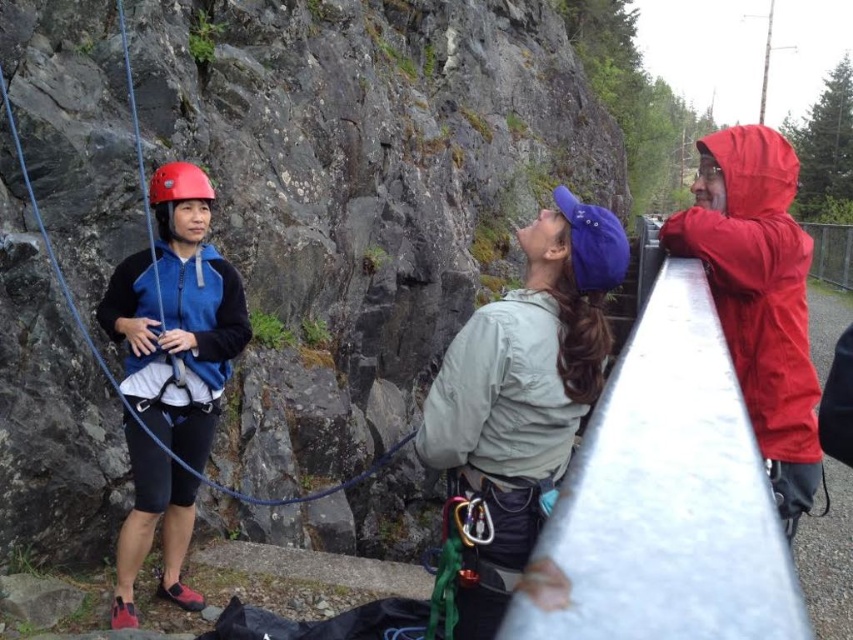
Can you confirm if matte blue jacket at left is wider than red waterproof jacket at upper right?

Incorrect, matte blue jacket at left's width does not surpass red waterproof jacket at upper right's.

Where is `matte blue jacket at left`? This screenshot has width=853, height=640. matte blue jacket at left is located at coordinates (177, 316).

Can you confirm if red waterproof jacket at upper right is taller than red matte helmet at left?

Correct, red waterproof jacket at upper right is much taller as red matte helmet at left.

Locate an element on the screen. red waterproof jacket at upper right is located at coordinates (758, 296).

Is light gray fabric jacket at center shorter than red matte helmet at left?

Incorrect, light gray fabric jacket at center's height does not fall short of red matte helmet at left's.

Looking at this image, between light gray fabric jacket at center and red matte helmet at left, which one appears on the right side from the viewer's perspective?

Positioned to the right is light gray fabric jacket at center.

Is point (524, 449) closer to viewer compared to point (175, 188)?

Yes, it is in front of point (175, 188).

Locate an element on the screen. light gray fabric jacket at center is located at coordinates (521, 396).